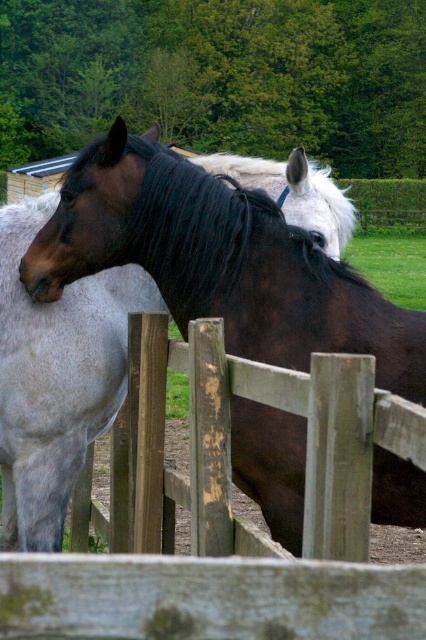
You are a photographer setting up a camera to capture both the shiny brown horse at left and the shiny brown horse at center in a single shot. Based on their positions, which horse might require more space in the frame to avoid being cut off?

The shiny brown horse at left might require more space in the frame since it is wider than the shiny brown horse at center according to the description.

You are a farmer checking the fence and the horse. Can you determine if the weathered wood fence at center is tall enough to prevent the shiny brown horse at left from jumping over it?

The weathered wood fence at center is not as tall as shiny brown horse at left, so the fence may not be tall enough to prevent the horse from jumping over it.

You are a photographer trying to capture both the shiny brown horse at left and the shiny brown horse at center in a single frame. Given their sizes, which horse should you focus on to ensure both are clearly visible in your photo?

The shiny brown horse at left is larger, so focusing on it while adjusting the camera angle to include the smaller shiny brown horse at center will help ensure both are clearly visible in the photo.